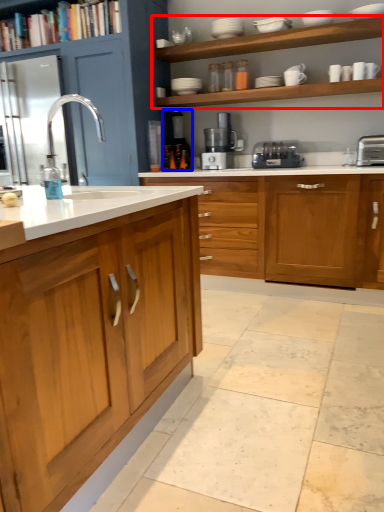
Question: Which point is closer to the camera, shelf (highlighted by a red box) or coffee machine (highlighted by a blue box)?

Choices:
 (A) shelf
 (B) coffee machine

Answer: (A)